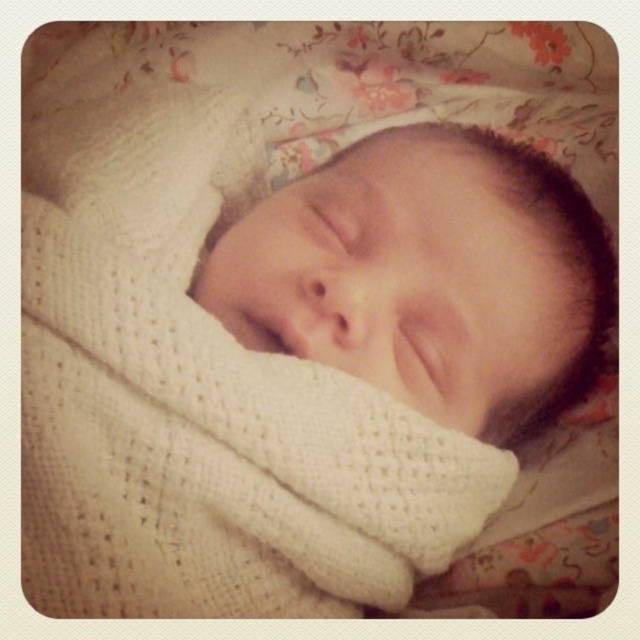
Based on the photo, can you confirm if white knitted blanket at center is positioned to the left of white knitted newborn at center?

Correct, you'll find white knitted blanket at center to the left of white knitted newborn at center.

Can you confirm if white knitted blanket at center is taller than white knitted newborn at center?

Yes, white knitted blanket at center is taller than white knitted newborn at center.

Measure the distance between white knitted blanket at center and camera.

They are 17.35 inches apart.

Where is `white knitted blanket at center`? Image resolution: width=640 pixels, height=640 pixels. white knitted blanket at center is located at coordinates (204, 406).